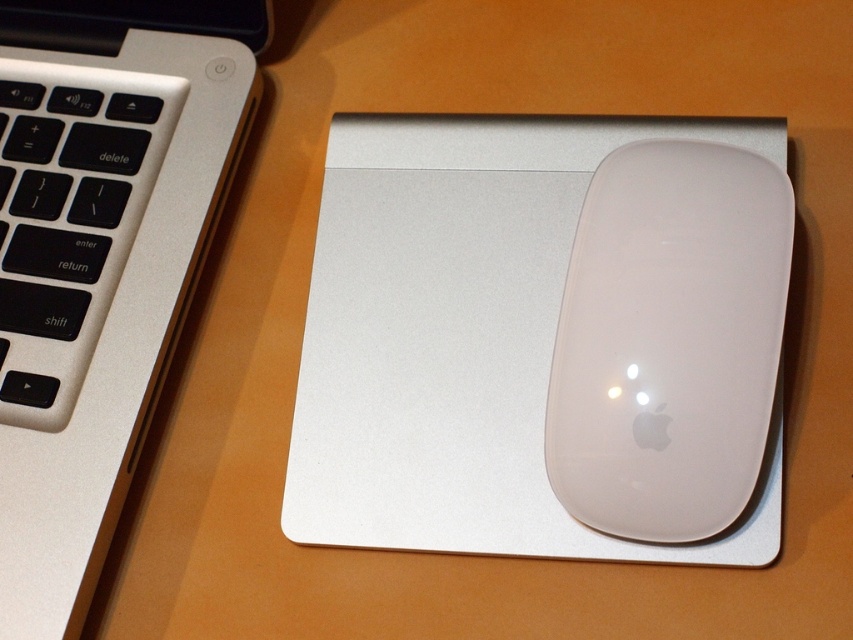
Question: Which object is closer to the camera taking this photo?

Choices:
 (A) white matte mouse pad at center
 (B) silver metallic keyboard at left

Answer: (A)

Question: Can you confirm if silver metallic keyboard at upper left is smaller than white matte mouse at right?

Choices:
 (A) yes
 (B) no

Answer: (B)

Question: Does white matte mouse pad at center have a lesser width compared to silver metallic keyboard at left?

Choices:
 (A) yes
 (B) no

Answer: (B)

Question: Which is farther from the white matte mouse at right?

Choices:
 (A) white matte mouse pad at center
 (B) silver metallic keyboard at upper left

Answer: (B)

Question: In this image, where is white matte mouse pad at center located relative to white matte mouse at right?

Choices:
 (A) right
 (B) left

Answer: (B)

Question: Which object is positioned closest to the white matte mouse pad at center?

Choices:
 (A) white matte mouse at right
 (B) silver metallic keyboard at left

Answer: (A)